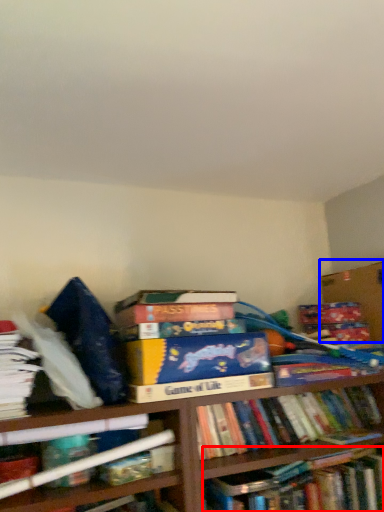
Question: Which of the following is the closest to the observer, book (highlighted by a red box) or cardboard box (highlighted by a blue box)?

Choices:
 (A) book
 (B) cardboard box

Answer: (A)